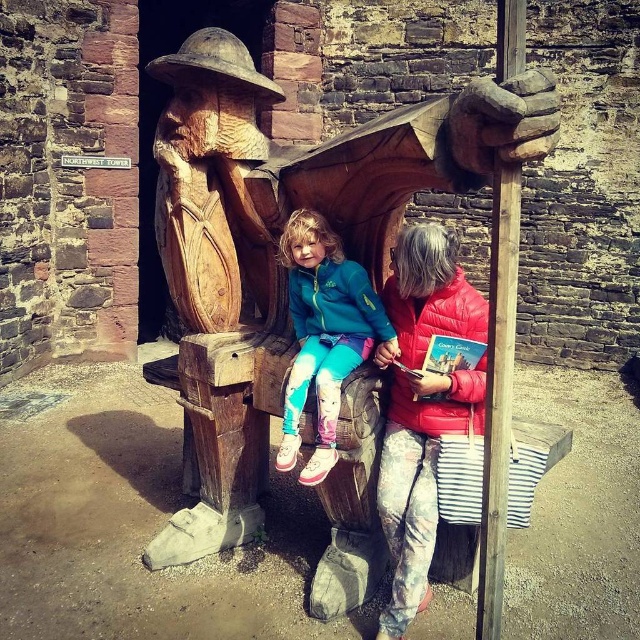
You are standing in front of the natural wood bench at center and want to take a photo of it with your camera. If the recommended distance for clear photos is 6 feet, is the current distance sufficient?

The natural wood bench at center and camera are 6.48 feet apart, which is slightly more than the recommended 6 feet. However, this distance should still be sufficient for a clear photo as the difference is minimal.

You are a photographer planning to take a photo of the natural wood bench at center and the teal matte jacket at center. Since you want to ensure both are clearly visible, which object should you focus on first to account for their sizes?

The natural wood bench at center is larger than the teal matte jacket at center, so you should focus on the natural wood bench at center first to ensure its details are captured clearly before adjusting for the smaller object.

You are a photographer planning to take a photo of the natural wood bench at center and the teal matte jacket at center. To ensure both are fully visible in the frame, which object should you position closer to the camera?

The natural wood bench at center is wider than the teal matte jacket at center, so you should position the natural wood bench at center closer to the camera to ensure both fit within the frame.